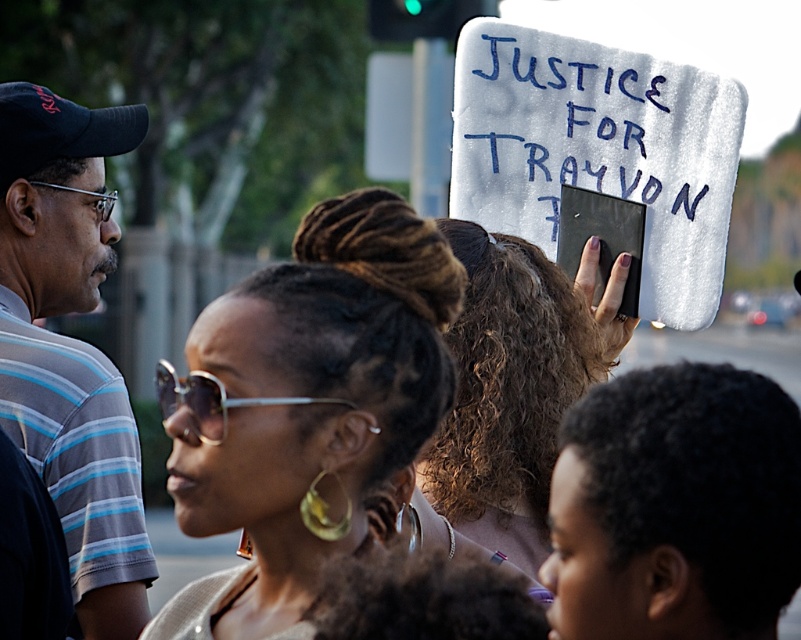
You are a photographer trying to capture a clear shot of the sign held by the person in the center. The sunglasses at center and the striped cotton shirt at left are blocking your view. Which object should you move to the left to get a better angle?

The sunglasses at center is positioned on the right side of the striped cotton shirt at left. To get a better angle, you should move the sunglasses at center to the left, away from the striped cotton shirt at left.

You are a photographer trying to capture the protest scene. You notice the sunglasses at center and the curly brown hair at center. Which object is taller when viewed from your camera angle?

The curly brown hair at center is taller than the sunglasses at center.